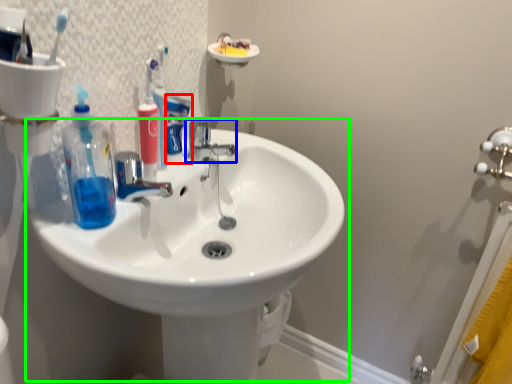
Question: Which is nearer to the toothpaste (highlighted by a red box)? tap (highlighted by a blue box) or sink (highlighted by a green box).

Choices:
 (A) tap
 (B) sink

Answer: (A)